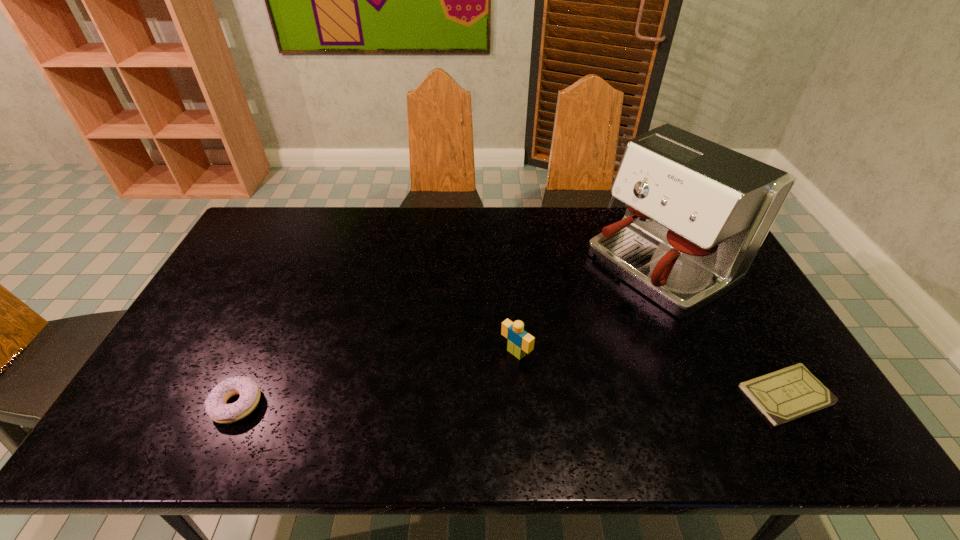
Locate an element on the screen. The image size is (960, 540). free spot on the desktop that is between the third tallest object and the checkbook and is positioned on the face of the second tallest object is located at coordinates (461, 401).

Where is `free spot on the desktop that is between the third tallest object and the checkbook and is positioned on the front of the tallest object near the spout`? free spot on the desktop that is between the third tallest object and the checkbook and is positioned on the front of the tallest object near the spout is located at coordinates (437, 401).